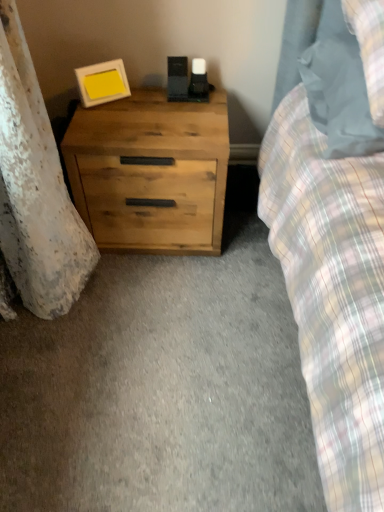
Describe the element at coordinates (102, 82) in the screenshot. The image size is (384, 512). I see `matte white picture frame at upper left` at that location.

Where is `matte white picture frame at upper left`? matte white picture frame at upper left is located at coordinates (102, 82).

From a real-world perspective, is natural wood chest of drawers at lower left under matte white picture frame at upper left?

Indeed, from a real-world perspective, natural wood chest of drawers at lower left is positioned beneath matte white picture frame at upper left.

Is natural wood chest of drawers at lower left positioned beyond the bounds of matte white picture frame at upper left?

natural wood chest of drawers at lower left lies outside matte white picture frame at upper left's area.

Is natural wood chest of drawers at lower left facing towards matte white picture frame at upper left?

No, natural wood chest of drawers at lower left is not aimed at matte white picture frame at upper left.

From the image's perspective, between natural wood chest of drawers at lower left and matte white picture frame at upper left, who is located below?

natural wood chest of drawers at lower left.

From a real-world perspective, which object rests below the other?

natural wood chest of drawers at lower left is physically lower.

Which is in front, natural wood chest of drawers at lower left or matte gray pillow at upper right?

Positioned in front is matte gray pillow at upper right.

Considering the positions of objects natural wood chest of drawers at lower left and matte gray pillow at upper right in the image provided, who is more to the right, natural wood chest of drawers at lower left or matte gray pillow at upper right?

From the viewer's perspective, matte gray pillow at upper right appears more on the right side.

Can matte gray pillow at upper right be found inside natural wood chest of drawers at lower left?

No, matte gray pillow at upper right is not surrounded by natural wood chest of drawers at lower left.

Is matte white picture frame at upper left located outside matte gray pillow at upper right?

Absolutely, matte white picture frame at upper left is external to matte gray pillow at upper right.

Between matte white picture frame at upper left and matte gray pillow at upper right, which one has less height?

matte white picture frame at upper left is shorter.

How distant is matte white picture frame at upper left from matte gray pillow at upper right?

They are 27.72 inches apart.

Can you tell me how much matte white picture frame at upper left and matte gray pillow at upper right differ in facing direction?

The angle between the facing direction of matte white picture frame at upper left and the facing direction of matte gray pillow at upper right is 32 degrees.

Which is nearer, (x=99, y=75) or (x=152, y=140)?

Point (x=99, y=75) appears to be farther away from the viewer than point (x=152, y=140).

Is matte white picture frame at upper left in front of natural wood chest of drawers at lower left?

No.

Is natural wood chest of drawers at lower left located within matte white picture frame at upper left?

No, natural wood chest of drawers at lower left is not inside matte white picture frame at upper left.

Where is `picture frame behind the natural wood chest of drawers at lower left`? This screenshot has width=384, height=512. picture frame behind the natural wood chest of drawers at lower left is located at coordinates (102, 82).

Based on the photo, is matte gray pillow at upper right oriented towards matte white picture frame at upper left?

No, matte gray pillow at upper right is not oriented towards matte white picture frame at upper left.

Considering the sizes of matte gray pillow at upper right and matte white picture frame at upper left in the image, is matte gray pillow at upper right taller or shorter than matte white picture frame at upper left?

Clearly, matte gray pillow at upper right is taller compared to matte white picture frame at upper left.

Is matte gray pillow at upper right to the left or to the right of matte white picture frame at upper left in the image?

matte gray pillow at upper right is to the right of matte white picture frame at upper left.

From a real-world perspective, is matte gray pillow at upper right beneath matte white picture frame at upper left?

No, from a real-world perspective, matte gray pillow at upper right is not beneath matte white picture frame at upper left.

Considering the relative positions of matte gray pillow at upper right and natural wood chest of drawers at lower left in the image provided, is matte gray pillow at upper right to the left or to the right of natural wood chest of drawers at lower left?

matte gray pillow at upper right is positioned on natural wood chest of drawers at lower left's right side.

Which is further, (333, 35) or (221, 132)?

The point (221, 132) is more distant.

Are matte gray pillow at upper right and natural wood chest of drawers at lower left located far from each other?

No.

In the scene shown: Does matte gray pillow at upper right have a greater width compared to natural wood chest of drawers at lower left?

Correct, the width of matte gray pillow at upper right exceeds that of natural wood chest of drawers at lower left.

Identify the location of picture frame that appears on the left of natural wood chest of drawers at lower left. (102, 82).

I want to click on the chest of drawers located behind the matte gray pillow at upper right, so click(150, 172).

Based on the photo, which object lies nearer to the anchor point natural wood chest of drawers at lower left, matte gray pillow at upper right or matte white picture frame at upper left?

matte white picture frame at upper left is closer to natural wood chest of drawers at lower left.

Considering their positions, is matte white picture frame at upper left positioned further to matte gray pillow at upper right than natural wood chest of drawers at lower left?

Based on the image, matte white picture frame at upper left appears to be further to matte gray pillow at upper right.

Based on the photo, considering their positions, is matte white picture frame at upper left positioned closer to natural wood chest of drawers at lower left than matte gray pillow at upper right?

matte white picture frame at upper left is closer to natural wood chest of drawers at lower left.

Which object lies further to the anchor point matte white picture frame at upper left, matte gray pillow at upper right or natural wood chest of drawers at lower left?

Among the two, matte gray pillow at upper right is located further to matte white picture frame at upper left.

Which object lies nearer to the anchor point matte white picture frame at upper left, natural wood chest of drawers at lower left or matte gray pillow at upper right?

Among the two, natural wood chest of drawers at lower left is located nearer to matte white picture frame at upper left.

Looking at the image, which one is located further to matte gray pillow at upper right, natural wood chest of drawers at lower left or matte white picture frame at upper left?

matte white picture frame at upper left.

Identify the location of chest of drawers between matte white picture frame at upper left and matte gray pillow at upper right from left to right. (150, 172).